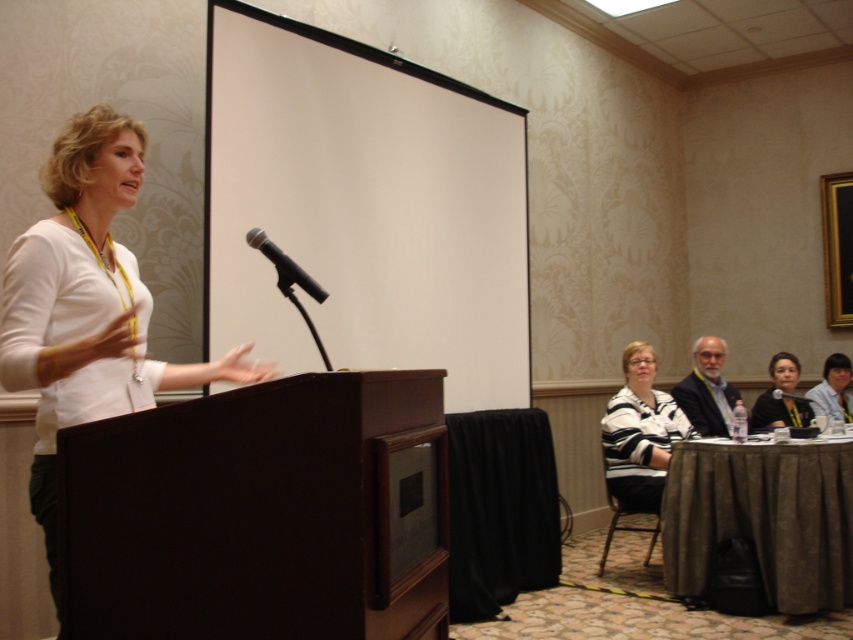
You are taking a photo of the presentation scene. You notice two points in the image at coordinates point (282, 269) and point (799, 397). Which point will appear larger in your photo?

Point (282, 269) is closer to the camera than point (799, 397), so it will appear larger in the photo.

You are a sound technician setting up for a presentation. You need to place a new speaker system at point 0.5, 0.5. The metallic silver microphone at center is at point 0.416, 0.334. Will the new speaker system be closer to the microphone than 0.1 units?

The distance between the microphone at (283, 266) and the speaker system at (426, 320) is sqrt of squared differences in coordinates. Calculating sqrt of squared differences in x and y coordinates gives sqrt of 0.084 squared plus 0.166 squared equals sqrt of 0.007056 plus 0.027556 equals sqrt of 0.034612 equals approximately 0.186 units. Since 0.186 is greater than 0.1, the speaker system will not be closer than 0.1 units to the microphone.